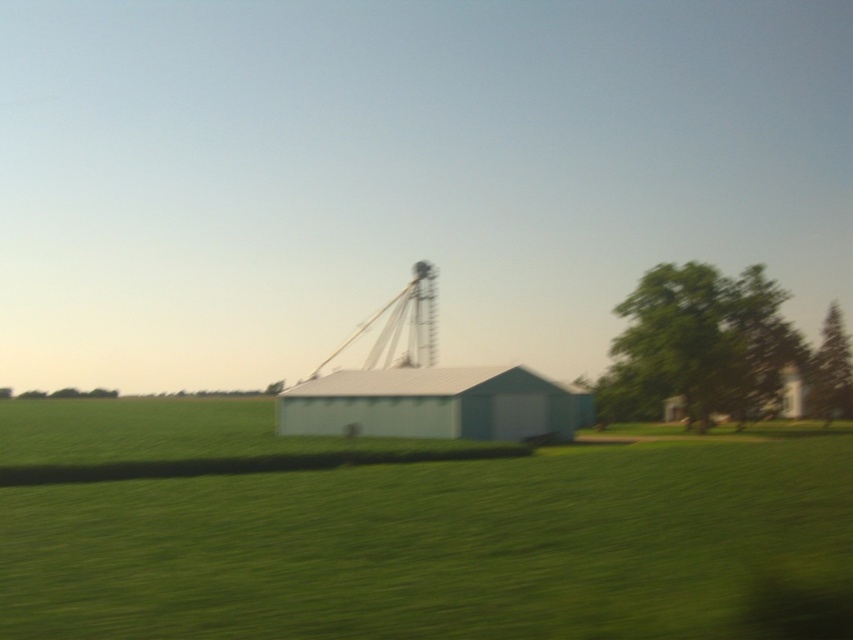
You are standing in the field looking at the white corrugated metal barn at center and the green leafy tree at right. Which object appears taller from your viewpoint?

The green leafy tree at right is much taller than the white corrugated metal barn at center, so it appears taller from your viewpoint.

You are standing in the middle of the field shown in the image. You see a point marked at coordinates [450,547]. What is located at that point?

The point at coordinates [450,547] corresponds to the green grass at center.

You are standing in the field and want to take a photo of the white corrugated metal barn at center. To ensure the green grass at center is in focus, should you adjust the camera to focus on the foreground or background?

The green grass at center is closer to the viewer than the white corrugated metal barn at center, so to focus on the green grass at center, adjust the camera to focus on the foreground.